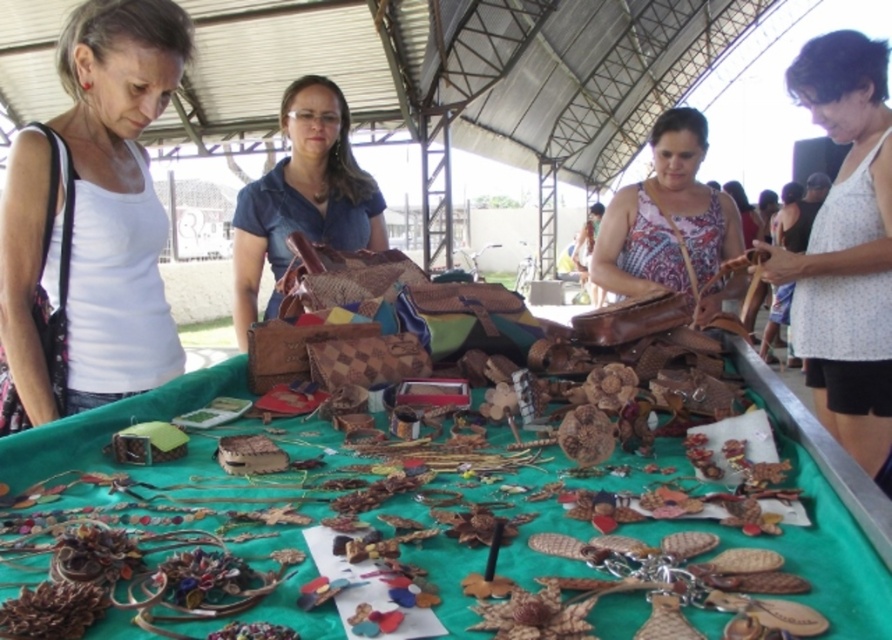
Question: Can you confirm if white matte tank top at left is smaller than patterned fabric purse at center?

Choices:
 (A) yes
 (B) no

Answer: (A)

Question: Which object is farther from the camera taking this photo?

Choices:
 (A) white matte tank top at left
 (B) green fabric at center
 (C) matte brown leather purse at center

Answer: (C)

Question: Can you confirm if green fabric at center is positioned above white dotted tank top at right?

Choices:
 (A) no
 (B) yes

Answer: (A)

Question: Which point is farther from the camera taking this photo?

Choices:
 (A) (242, 237)
 (B) (54, 268)

Answer: (A)

Question: Estimate the real-world distances between objects in this image. Which object is closer to the white dotted tank top at right?

Choices:
 (A) white matte tank top at left
 (B) green fabric at center
 (C) matte brown leather purse at center
 (D) patterned fabric purse at center

Answer: (D)

Question: Can you confirm if white matte tank top at left is positioned above matte brown leather purse at center?

Choices:
 (A) yes
 (B) no

Answer: (B)